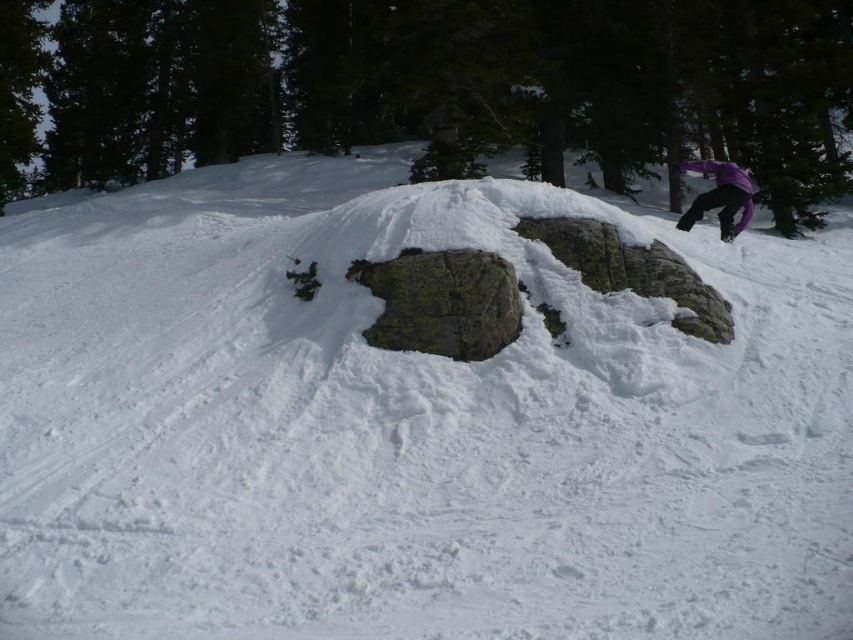
Is point (480, 330) less distant than point (730, 218)?

Yes, point (480, 330) is in front of point (730, 218).

Which is behind, point (451, 332) or point (695, 202)?

The point (695, 202) is behind.

Is point (422, 284) positioned before point (749, 196)?

Yes, point (422, 284) is in front of point (749, 196).

Locate an element on the screen. The height and width of the screenshot is (640, 853). gray rough rock at center is located at coordinates (442, 301).